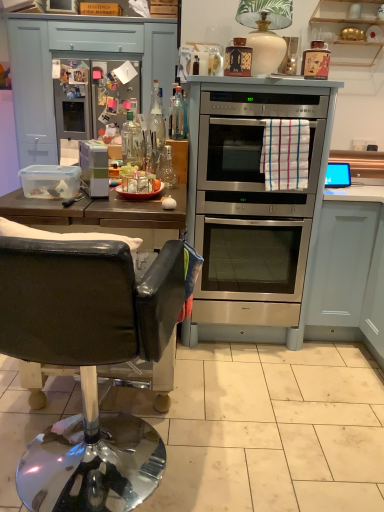
Where is `vacant area that lies to the right of black leather chair at left`? The height and width of the screenshot is (512, 384). vacant area that lies to the right of black leather chair at left is located at coordinates (239, 446).